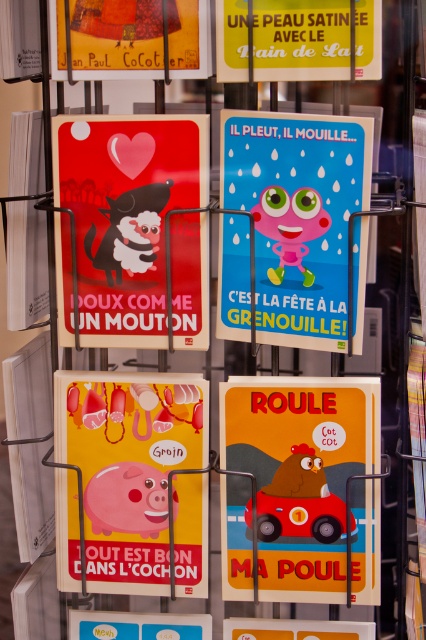
Is matte plastic car at center further to camera compared to yellow satin skin at upper center?

That is True.

Is matte plastic car at center to the left of yellow satin skin at upper center from the viewer's perspective?

In fact, matte plastic car at center is to the right of yellow satin skin at upper center.

Find the location of a particular element. Image resolution: width=426 pixels, height=640 pixels. matte plastic car at center is located at coordinates (301, 474).

Does matte red poster at upper left have a smaller size compared to blue glossy poster at center?

Yes, matte red poster at upper left is smaller than blue glossy poster at center.

What do you see at coordinates (126, 216) in the screenshot? Image resolution: width=426 pixels, height=640 pixels. I see `matte red poster at upper left` at bounding box center [126, 216].

Does point (204, 243) lie in front of point (298, 300)?

Yes.

Where is `matte red poster at upper left`? matte red poster at upper left is located at coordinates (126, 216).

Does yellow satin skin at upper center appear on the left side of matte yellow poster at upper left?

In fact, yellow satin skin at upper center is to the right of matte yellow poster at upper left.

Is yellow satin skin at upper center thinner than matte yellow poster at upper left?

Indeed, yellow satin skin at upper center has a lesser width compared to matte yellow poster at upper left.

Is point (357, 10) farther from viewer compared to point (195, 49)?

No.

At what (x,y) coordinates should I click in order to perform the action: click on yellow satin skin at upper center. Please return your answer as a coordinate pair (x, y). The image size is (426, 640). Looking at the image, I should click on (316, 38).